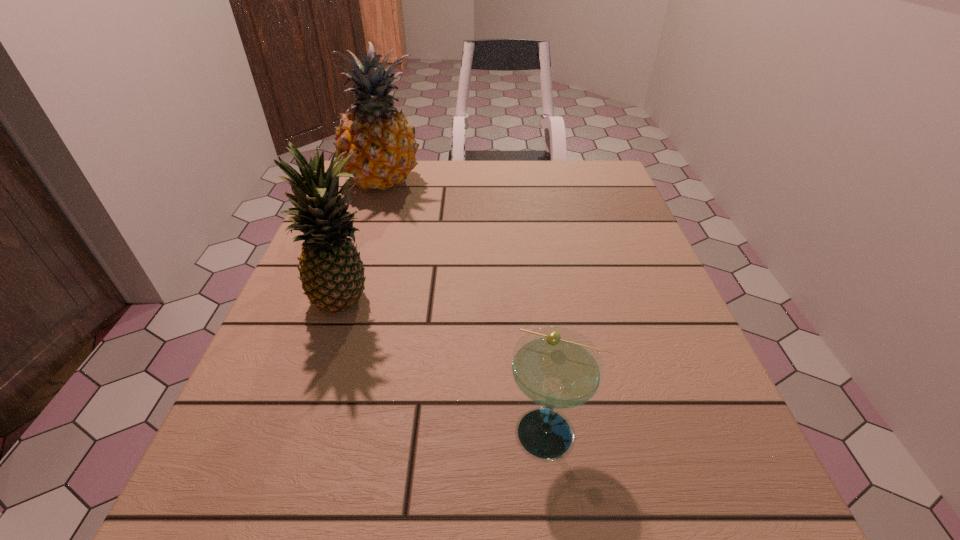
Locate an element on the screen. free space between the nearer pineapple and the shortest object is located at coordinates click(x=448, y=368).

Find the location of a particular element. The image size is (960, 540). vacant space in between the farthest object and the second nearest object is located at coordinates (365, 242).

Image resolution: width=960 pixels, height=540 pixels. I want to click on free area in between the nearer pineapple and the farther pineapple, so click(x=365, y=242).

You are a GUI agent. You are given a task and a screenshot of the screen. Output one action in this format:
    pyautogui.click(x=<x>, y=<y>)
    Task: Click on the object that is the second nearest to the farthest object
    
    Given the screenshot: What is the action you would take?
    pyautogui.click(x=556, y=368)

Identify the location of object that stands as the closest to the martini. (332, 274).

Locate an element on the screen. The height and width of the screenshot is (540, 960). free location that satisfies the following two spatial constraints: 1. on the front side of the farthest object; 2. on the left side of the shortest object is located at coordinates (302, 433).